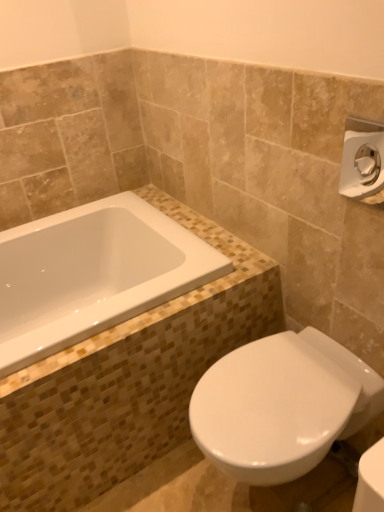
Question: Does white glossy toilet at lower right have a smaller size compared to white glossy bathtub at upper left?

Choices:
 (A) yes
 (B) no

Answer: (B)

Question: Does white glossy toilet at lower right lie in front of white glossy bathtub at upper left?

Choices:
 (A) no
 (B) yes

Answer: (B)

Question: From a real-world perspective, is white glossy toilet at lower right physically below white glossy bathtub at upper left?

Choices:
 (A) no
 (B) yes

Answer: (B)

Question: Considering the relative sizes of white glossy toilet at lower right and white glossy bathtub at upper left in the image provided, is white glossy toilet at lower right thinner than white glossy bathtub at upper left?

Choices:
 (A) no
 (B) yes

Answer: (B)

Question: Considering the relative sizes of white glossy toilet at lower right and white glossy bathtub at upper left in the image provided, is white glossy toilet at lower right taller than white glossy bathtub at upper left?

Choices:
 (A) yes
 (B) no

Answer: (A)

Question: Is white glossy bathtub at upper left wider or thinner than satin nickel towel bar at upper right?

Choices:
 (A) thin
 (B) wide

Answer: (B)

Question: In terms of height, does white glossy bathtub at upper left look taller or shorter compared to satin nickel towel bar at upper right?

Choices:
 (A) tall
 (B) short

Answer: (B)

Question: From the image's perspective, is white glossy bathtub at upper left positioned above or below satin nickel towel bar at upper right?

Choices:
 (A) above
 (B) below

Answer: (B)

Question: Which is correct: white glossy bathtub at upper left is inside satin nickel towel bar at upper right, or outside of it?

Choices:
 (A) outside
 (B) inside

Answer: (A)

Question: In the image, is white glossy bathtub at upper left positioned in front of or behind white glossy toilet at lower right?

Choices:
 (A) behind
 (B) front

Answer: (A)

Question: Looking at their shapes, would you say white glossy bathtub at upper left is wider or thinner than white glossy toilet at lower right?

Choices:
 (A) thin
 (B) wide

Answer: (B)

Question: Considering the positions of point (62, 264) and point (248, 400), is point (62, 264) closer or farther from the camera than point (248, 400)?

Choices:
 (A) farther
 (B) closer

Answer: (A)

Question: Is white glossy bathtub at upper left taller or shorter than white glossy toilet at lower right?

Choices:
 (A) tall
 (B) short

Answer: (B)

Question: From a real-world perspective, is satin nickel towel bar at upper right physically located above or below white glossy bathtub at upper left?

Choices:
 (A) above
 (B) below

Answer: (A)

Question: Is satin nickel towel bar at upper right wider or thinner than white glossy bathtub at upper left?

Choices:
 (A) thin
 (B) wide

Answer: (A)